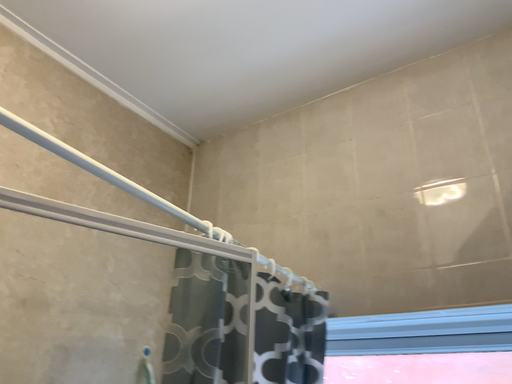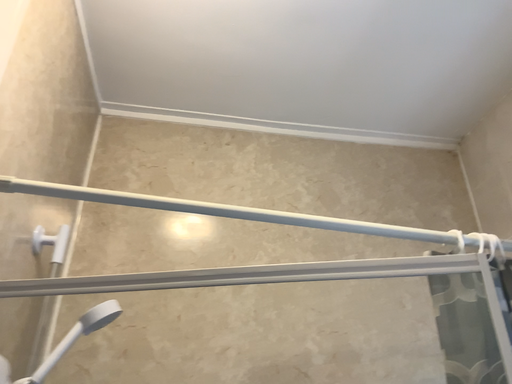
Question: Which way did the camera rotate in the video?

Choices:
 (A) rotated right
 (B) rotated left

Answer: (B)